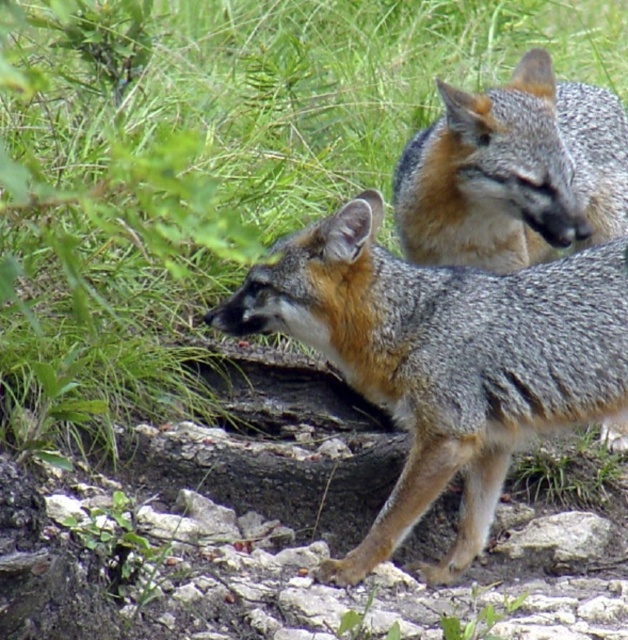
Is point (440, 58) positioned before point (522, 64)?

No.

Can you confirm if green leafy grass at upper left is wider than gray fur fox at upper right?

Yes.

Identify the location of green leafy grass at upper left. (219, 134).

Does gray fur fox at center have a smaller size compared to gray fur fox at upper right?

No.

Is gray fur fox at center to the left of gray fur fox at upper right from the viewer's perspective?

Indeed, gray fur fox at center is positioned on the left side of gray fur fox at upper right.

Who is more distant from viewer, (320, 288) or (575, 92)?

Positioned behind is point (575, 92).

The height and width of the screenshot is (640, 628). Identify the location of gray fur fox at center. (443, 358).

How far apart are green leafy grass at upper left and gray fur fox at center?

green leafy grass at upper left and gray fur fox at center are 37.86 inches apart.

Looking at this image, which is more to the left, green leafy grass at upper left or gray fur fox at center?

green leafy grass at upper left

Is point (124, 214) farther from camera compared to point (347, 269)?

That is True.

Where is `green leafy grass at upper left`? This screenshot has height=640, width=628. green leafy grass at upper left is located at coordinates (219, 134).